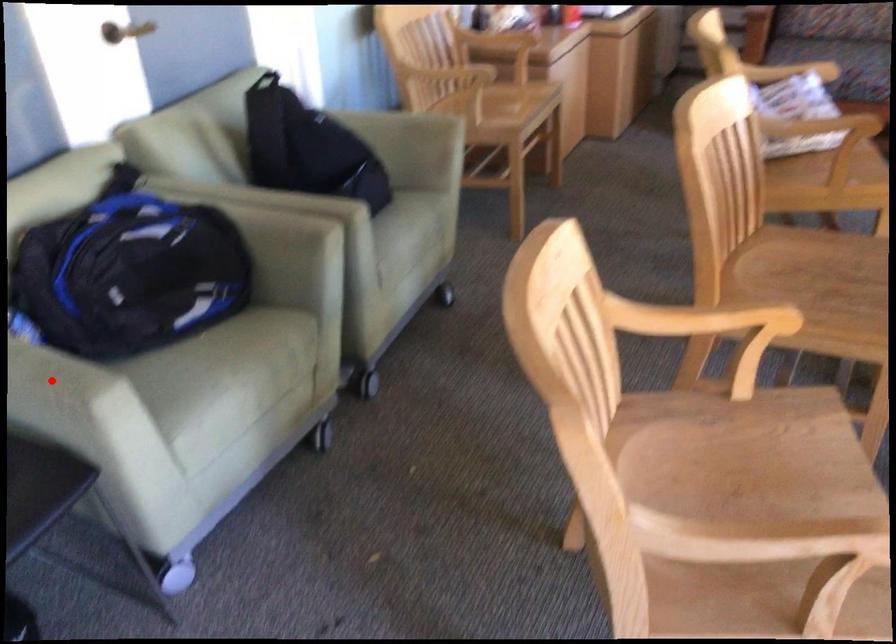
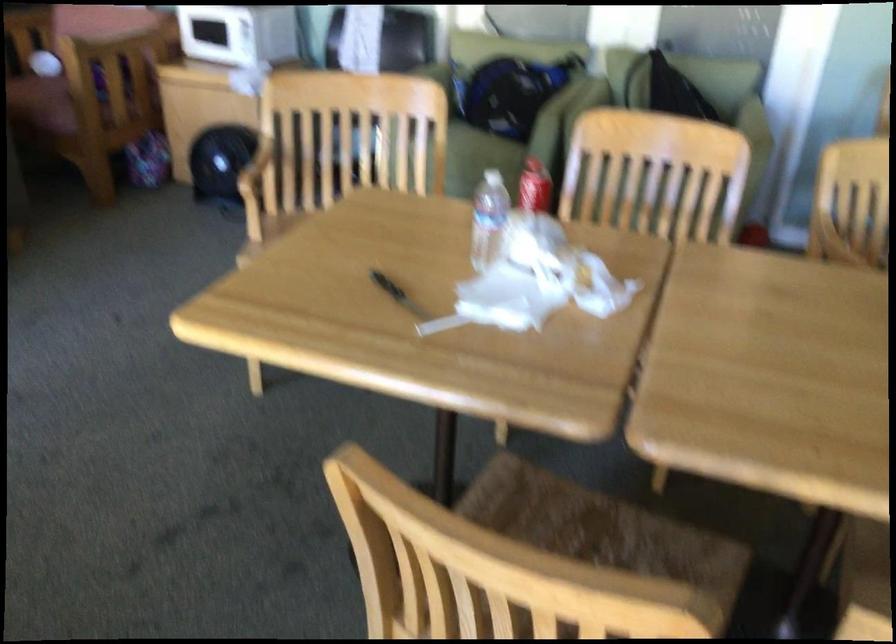
Question: I am providing you with two images of the same scene from different viewpoints. A red point is marked on the first image. Is the red point's position out of view in image 2?

Choices:
 (A) Yes
 (B) No

Answer: (A)